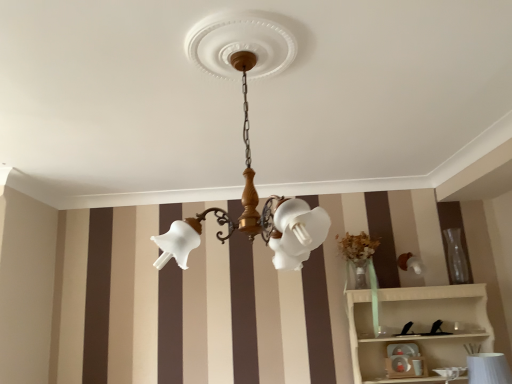
Question: Would you say white wood shelf at lower right is to the left or to the right of matte white toy at lower center in the picture?

Choices:
 (A) right
 (B) left

Answer: (A)

Question: Considering the positions of white wood shelf at lower right and matte white toy at lower center in the image, is white wood shelf at lower right wider or thinner than matte white toy at lower center?

Choices:
 (A) wide
 (B) thin

Answer: (A)

Question: Estimate the real-world distances between objects in this image. Which object is closer to the white textured vase at lower right?

Choices:
 (A) transparent glass vase at right
 (B) matte white glass chandelier at center
 (C) matte white toy at lower center
 (D) white wood shelf at lower right

Answer: (D)

Question: Which is nearer to the white textured vase at lower right?

Choices:
 (A) matte white glass chandelier at center
 (B) white wood shelf at lower right
 (C) transparent glass vase at right
 (D) matte white toy at lower center

Answer: (B)